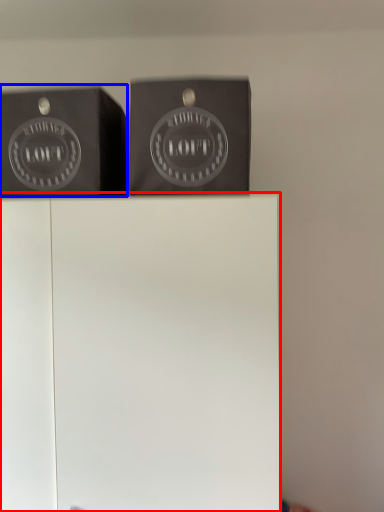
Question: Which point is closer to the camera, furniture (highlighted by a red box) or writing (highlighted by a blue box)?

Choices:
 (A) furniture
 (B) writing

Answer: (A)